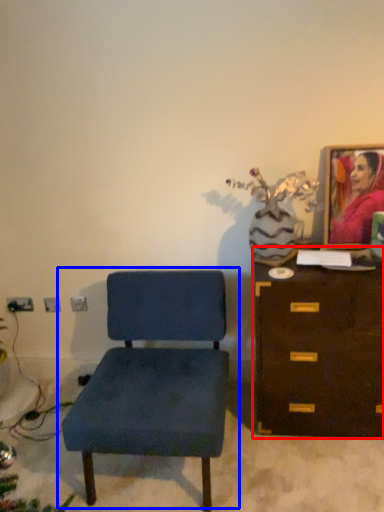
Question: Which object appears farthest to the camera in this image, chest of drawers (highlighted by a red box) or chair (highlighted by a blue box)?

Choices:
 (A) chest of drawers
 (B) chair

Answer: (A)